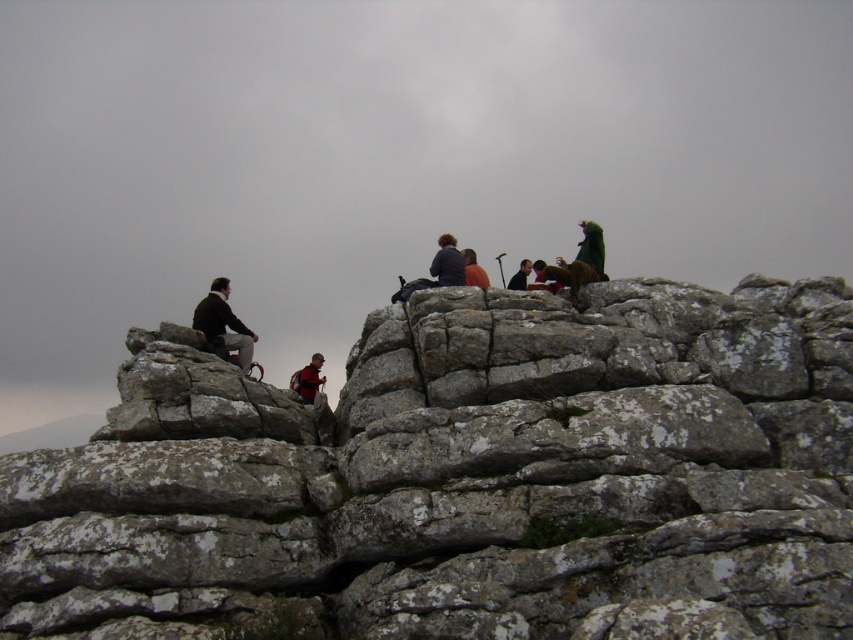
You are a photographer trying to capture a group photo of the dark brown leather jacket at left and the matte gray backpack at center. Since you want to include both in the frame, which direction should you move to ensure both are visible?

You should move to the right side of the dark brown leather jacket at left to ensure both the dark brown leather jacket at left and the matte gray backpack at center are visible in the frame.

You are planning to place a small backpack between the rough stone rock at center and the dark blue jacket at center. Based on the scene description, will the backpack fit between them?

The rough stone rock at center is wider than the dark blue jacket at center, so the backpack may fit between them depending on the backpack size and the space available between the two objects.